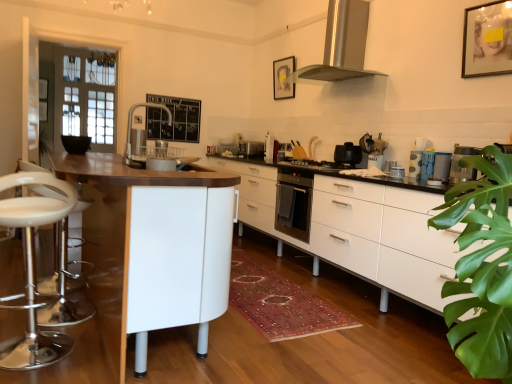
Question: From the image's perspective, does white glossy coffee maker at center, positioned as the 3th appliance in back-to-front order, appear higher than white glossy coffee maker at center, positioned as the 2th appliance in back-to-front order?

Choices:
 (A) yes
 (B) no

Answer: (B)

Question: From a real-world perspective, is white glossy coffee maker at center, the 1th appliance in the bottom-to-top sequence, physically below white glossy coffee maker at center, positioned as the 2th appliance in back-to-front order?

Choices:
 (A) no
 (B) yes

Answer: (B)

Question: Considering the relative positions of white glossy coffee maker at center, which is the second appliance from left to right, and white glossy coffee maker at center, positioned as the 2th appliance in back-to-front order, in the image provided, is white glossy coffee maker at center, which is the second appliance from left to right, to the right of white glossy coffee maker at center, positioned as the 2th appliance in back-to-front order, from the viewer's perspective?

Choices:
 (A) no
 (B) yes

Answer: (A)

Question: Does white glossy coffee maker at center, which is the second appliance from left to right, turn towards white glossy coffee maker at center, which ranks as the 2th appliance in right-to-left order?

Choices:
 (A) no
 (B) yes

Answer: (A)

Question: Is white glossy coffee maker at center, the 1th appliance in the bottom-to-top sequence, positioned far away from white glossy coffee maker at center, which is the second appliance from top to bottom?

Choices:
 (A) yes
 (B) no

Answer: (B)

Question: Considering the positions of satin silver toaster at center, acting as the first appliance starting from the top, and matte plastic cups at right, which is the fourth appliance in left-to-right order, in the image, is satin silver toaster at center, acting as the first appliance starting from the top, wider or thinner than matte plastic cups at right, which is the fourth appliance in left-to-right order,?

Choices:
 (A) thin
 (B) wide

Answer: (B)

Question: Relative to matte plastic cups at right, which is the fourth appliance in left-to-right order, is satin silver toaster at center, acting as the first appliance starting from the top, in front or behind?

Choices:
 (A) behind
 (B) front

Answer: (A)

Question: Is satin silver toaster at center, acting as the first appliance starting from the top, to the left or to the right of matte plastic cups at right, which is the fourth appliance in left-to-right order, in the image?

Choices:
 (A) left
 (B) right

Answer: (A)

Question: Looking at the image, does satin silver toaster at center, the fourth appliance when ordered from bottom to top, seem bigger or smaller compared to matte plastic cups at right, acting as the 1th appliance starting from the front?

Choices:
 (A) small
 (B) big

Answer: (B)

Question: Considering the positions of wooden picture frame at upper right, which appears as the 2th picture frame when viewed from the left, and matte black picture frame at upper center, the second picture frame from the right, in the image, is wooden picture frame at upper right, which appears as the 2th picture frame when viewed from the left, wider or thinner than matte black picture frame at upper center, the second picture frame from the right,?

Choices:
 (A) thin
 (B) wide

Answer: (B)

Question: From a real-world perspective, is wooden picture frame at upper right, arranged as the first picture frame when viewed from the right, physically located above or below matte black picture frame at upper center, which is the 1th picture frame from left to right?

Choices:
 (A) above
 (B) below

Answer: (A)

Question: In the image, is wooden picture frame at upper right, which ranks as the first picture frame in front-to-back order, positioned in front of or behind matte black picture frame at upper center, which is the 1th picture frame from left to right?

Choices:
 (A) front
 (B) behind

Answer: (A)

Question: Is point (480, 24) closer or farther from the camera than point (282, 74)?

Choices:
 (A) farther
 (B) closer

Answer: (B)

Question: Considering their positions, is white matte cabinet at center located in front of or behind matte plastic cups at right, acting as the 1th appliance starting from the front?

Choices:
 (A) front
 (B) behind

Answer: (A)

Question: Considering the positions of point (392, 263) and point (430, 173), is point (392, 263) closer or farther from the camera than point (430, 173)?

Choices:
 (A) farther
 (B) closer

Answer: (B)